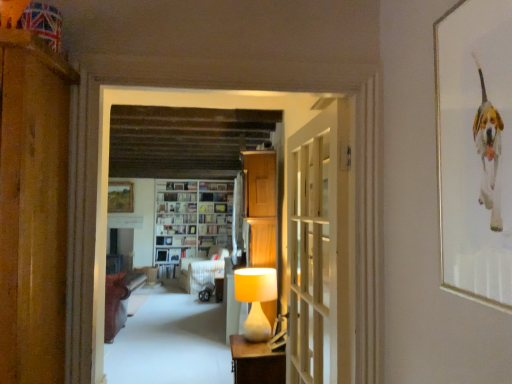
Locate an element on the screen. This screenshot has height=384, width=512. wooden picture frame at upper center, acting as the second picture frame starting from the right is located at coordinates (120, 197).

I want to click on metallic gold picture frame at upper right, which is counted as the 2th picture frame, starting from the back, so click(x=475, y=149).

At what (x,y) coordinates should I click in order to perform the action: click on matte brown wooden table at lower center, which is the 3th furniture from left to right. Please return your answer as a coordinate pair (x, y). Image resolution: width=512 pixels, height=384 pixels. Looking at the image, I should click on (256, 362).

What is the approximate width of white fabric sofa at center, which is the 2th furniture from left to right?

white fabric sofa at center, which is the 2th furniture from left to right, is 37.63 inches wide.

Find the location of a particular element. The width and height of the screenshot is (512, 384). wooden picture frame at upper center, positioned as the 1th picture frame in left-to-right order is located at coordinates (120, 197).

Is wooden picture frame at upper center, which is the second picture frame from front to back, taller or shorter than brown leather sofa at left, which ranks as the first furniture in left-to-right order?

In the image, wooden picture frame at upper center, which is the second picture frame from front to back, appears to be shorter than brown leather sofa at left, which ranks as the first furniture in left-to-right order.

In the scene shown: Between wooden picture frame at upper center, positioned as the 1th picture frame in left-to-right order, and brown leather sofa at left, which is the second furniture from front to back, which one appears on the left side from the viewer's perspective?

Positioned to the left is wooden picture frame at upper center, positioned as the 1th picture frame in left-to-right order.

Locate an element on the screen. furniture that is the 1st object to the right of the wooden picture frame at upper center, positioned as the 1th picture frame in left-to-right order, starting at the anchor is located at coordinates pos(119,300).

From a real-world perspective, is wooden picture frame at upper center, acting as the second picture frame starting from the right, positioned above or below brown leather sofa at left, which ranks as the first furniture in left-to-right order?

wooden picture frame at upper center, acting as the second picture frame starting from the right, is above brown leather sofa at left, which ranks as the first furniture in left-to-right order.

In the scene shown: Can you tell me how much brown leather sofa at left, which is the second furniture from front to back, and wooden picture frame at upper center, positioned as the 1th picture frame in left-to-right order, differ in facing direction?

They differ by 180 degrees in their facing directions.

Considering the sizes of brown leather sofa at left, which is the second furniture from front to back, and wooden picture frame at upper center, acting as the second picture frame starting from the right, in the image, is brown leather sofa at left, which is the second furniture from front to back, bigger or smaller than wooden picture frame at upper center, acting as the second picture frame starting from the right,?

brown leather sofa at left, which is the second furniture from front to back, is bigger than wooden picture frame at upper center, acting as the second picture frame starting from the right.

Considering the positions of points (115, 298) and (114, 194), is point (115, 298) farther from camera compared to point (114, 194)?

No, (115, 298) is in front of (114, 194).

Considering the relative positions of brown leather sofa at left, which ranks as the first furniture in left-to-right order, and wooden picture frame at upper center, acting as the second picture frame starting from the right, in the image provided, is brown leather sofa at left, which ranks as the first furniture in left-to-right order, to the left of wooden picture frame at upper center, acting as the second picture frame starting from the right, from the viewer's perspective?

No.

Between point (316, 202) and point (219, 302), which one is positioned behind?

The point (219, 302) is farther from the camera.

Which object is closer to the camera taking this photo, white wooden door at center or matte wooden table at center?

white wooden door at center is closer to the camera.

Which object is thinner, white wooden door at center or matte wooden table at center?

Thinner between the two is white wooden door at center.

Which of these two, white wooden door at center or matte wooden table at center, is bigger?

With larger size is white wooden door at center.

This screenshot has width=512, height=384. Find the location of `the 1st picture frame positioned above the hardcover book at center, marked as the fourth book in a top-to-bottom arrangement (from the image's perspective)`. the 1st picture frame positioned above the hardcover book at center, marked as the fourth book in a top-to-bottom arrangement (from the image's perspective) is located at coordinates (120, 197).

From a real-world perspective, who is located lower, wooden picture frame at upper center, which is counted as the 1th picture frame, starting from the back, or hardcover book at center, marked as the fourth book in a top-to-bottom arrangement?

From a 3D spatial view, hardcover book at center, marked as the fourth book in a top-to-bottom arrangement, is below.

Is wooden picture frame at upper center, acting as the second picture frame starting from the right, oriented towards hardcover book at center, marked as the fourth book in a top-to-bottom arrangement?

Answer: No.

Is metallic gold picture frame at upper right, which ranks as the 2th picture frame in left-to-right order, not within matte wooden table at center?

Absolutely, metallic gold picture frame at upper right, which ranks as the 2th picture frame in left-to-right order, is external to matte wooden table at center.

From the image's perspective, is metallic gold picture frame at upper right, the first picture frame viewed from the front, positioned above or below matte wooden table at center?

Based on their image positions, metallic gold picture frame at upper right, the first picture frame viewed from the front, is located above matte wooden table at center.

Would you say metallic gold picture frame at upper right, which ranks as the 2th picture frame in left-to-right order, is to the left or to the right of matte wooden table at center in the picture?

metallic gold picture frame at upper right, which ranks as the 2th picture frame in left-to-right order, is to the right of matte wooden table at center.

In the scene shown: Is hardcover book at center, the 2th book positioned from the bottom, turned away from wooden picture frame at upper center, acting as the second picture frame starting from the right?

hardcover book at center, the 2th book positioned from the bottom, is not turned away from wooden picture frame at upper center, acting as the second picture frame starting from the right.

Considering the positions of objects hardcover book at center, the 2th book positioned from the bottom, and wooden picture frame at upper center, acting as the second picture frame starting from the right, in the image provided, who is more to the right, hardcover book at center, the 2th book positioned from the bottom, or wooden picture frame at upper center, acting as the second picture frame starting from the right,?

From the viewer's perspective, hardcover book at center, the 2th book positioned from the bottom, appears more on the right side.

Which object is closer to the camera taking this photo, hardcover book at center, the 2th book positioned from the bottom, or wooden picture frame at upper center, which is the second picture frame from front to back?

wooden picture frame at upper center, which is the second picture frame from front to back, is in front.

From the image's perspective, which object appears higher, hardcover book at center, marked as the fourth book in a top-to-bottom arrangement, or wooden picture frame at upper center, acting as the second picture frame starting from the right?

From the image's view, wooden picture frame at upper center, acting as the second picture frame starting from the right, is above.

Considering the sizes of objects matte brown wooden table at lower center, the 1th furniture viewed from the right, and matte wooden table at center in the image provided, who is bigger, matte brown wooden table at lower center, the 1th furniture viewed from the right, or matte wooden table at center?

matte brown wooden table at lower center, the 1th furniture viewed from the right, is bigger.

Considering the sizes of matte brown wooden table at lower center, the 1th furniture viewed from the right, and matte wooden table at center in the image, is matte brown wooden table at lower center, the 1th furniture viewed from the right, taller or shorter than matte wooden table at center?

Considering their sizes, matte brown wooden table at lower center, the 1th furniture viewed from the right, has less height than matte wooden table at center.

From the image's perspective, which one is positioned higher, matte brown wooden table at lower center, the 1th furniture viewed from the right, or matte wooden table at center?

From the image's view, matte brown wooden table at lower center, the 1th furniture viewed from the right, is above.

Can you confirm if matte brown wooden table at lower center, which is the 3th furniture from left to right, is wider than matte wooden table at center?

Indeed, matte brown wooden table at lower center, which is the 3th furniture from left to right, has a greater width compared to matte wooden table at center.

Identify the location of the 1st furniture counting from the right of the wooden picture frame at upper center, which is counted as the 1th picture frame, starting from the back. This screenshot has width=512, height=384. (119, 300).

This screenshot has width=512, height=384. I want to click on furniture that is the 2nd one when counting forward from the wooden picture frame at upper center, acting as the second picture frame starting from the right, so click(x=119, y=300).

Considering their positions, is white glossy bookshelf at center, arranged as the third book when ordered from the bottom, positioned closer to metallic gold picture frame at upper right, the first picture frame viewed from the front, than white paper bookshelf at center, the fourth book in the bottom-to-top sequence?

Based on the image, white paper bookshelf at center, the fourth book in the bottom-to-top sequence, appears to be nearer to metallic gold picture frame at upper right, the first picture frame viewed from the front.

Based on their spatial positions, is matte cream lampshade at center or white fabric sofa at center, the 1th furniture when ordered from back to front, closer to wooden cabinet at center?

The object closer to wooden cabinet at center is matte cream lampshade at center.

Looking at the image, which one is located further to white paper bookshelf at center, which is the 2th book from top to bottom, white fabric curtain at center or matte brown wooden table at lower center, positioned as the 1th furniture in front-to-back order?

matte brown wooden table at lower center, positioned as the 1th furniture in front-to-back order, is positioned further to the anchor white paper bookshelf at center, which is the 2th book from top to bottom.

Considering their positions, is white fabric curtain at center positioned further to white fabric sofa at center, the 1th furniture when ordered from back to front, than white glossy bookshelf at center, which is the third book from top to bottom?

white fabric curtain at center lies further to white fabric sofa at center, the 1th furniture when ordered from back to front, than the other object.

Considering their positions, is matte wooden table at center positioned further to hardcover book at center, the 1th book from the top, than matte brown wooden table at lower center, which is the 3th furniture from left to right?

matte brown wooden table at lower center, which is the 3th furniture from left to right.

Estimate the real-world distances between objects in this image. Which object is closer to hardcover book at center, the 2th book positioned from the bottom, wooden cabinet at center or matte wooden table at center?

matte wooden table at center lies closer to hardcover book at center, the 2th book positioned from the bottom, than the other object.

Looking at the image, which one is located closer to brown leather sofa at left, which ranks as the first furniture in left-to-right order, white glossy bookshelf at center, which is the third book from top to bottom, or white wooden door at center?

white glossy bookshelf at center, which is the third book from top to bottom, lies closer to brown leather sofa at left, which ranks as the first furniture in left-to-right order, than the other object.

From the image, which object appears to be nearer to hardcover book at center, placed as the fifth book when sorted from bottom to top, hardcover book at center, the 2th book positioned from the bottom, or wooden picture frame at upper center, acting as the second picture frame starting from the right?

wooden picture frame at upper center, acting as the second picture frame starting from the right, is positioned closer to the anchor hardcover book at center, placed as the fifth book when sorted from bottom to top.

At what (x,y) coordinates should I click in order to perform the action: click on armoire positioned between white wooden door at center and white glossy bookshelf at center from near to far. Please return your answer as a coordinate pair (x, y). This screenshot has height=384, width=512. Looking at the image, I should click on (260, 208).

The height and width of the screenshot is (384, 512). Identify the location of table located between brown leather sofa at left, which ranks as the first furniture in left-to-right order, and white glossy bookshelf at center in the depth direction. (219, 286).

Where is `armoire between metallic gold picture frame at upper right, the first picture frame viewed from the front, and wooden picture frame at upper center, positioned as the 1th picture frame in left-to-right order, from front to back`? Image resolution: width=512 pixels, height=384 pixels. armoire between metallic gold picture frame at upper right, the first picture frame viewed from the front, and wooden picture frame at upper center, positioned as the 1th picture frame in left-to-right order, from front to back is located at coordinates (260, 208).

Locate an element on the screen. The image size is (512, 384). shelf that lies between white glossy bookshelf at center, arranged as the third book when ordered from the bottom, and hardcover book at center, marked as the fourth book in a top-to-bottom arrangement, from top to bottom is located at coordinates (191, 220).